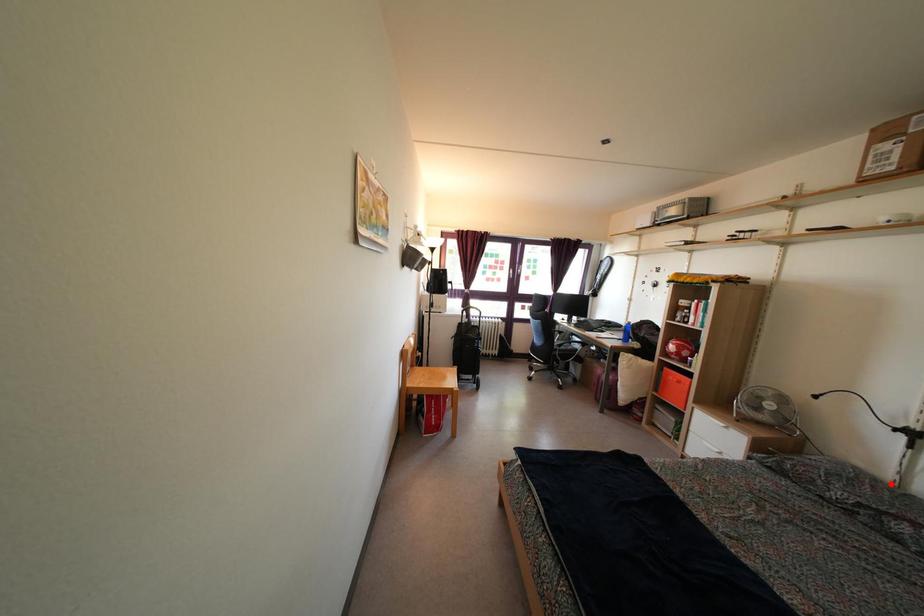
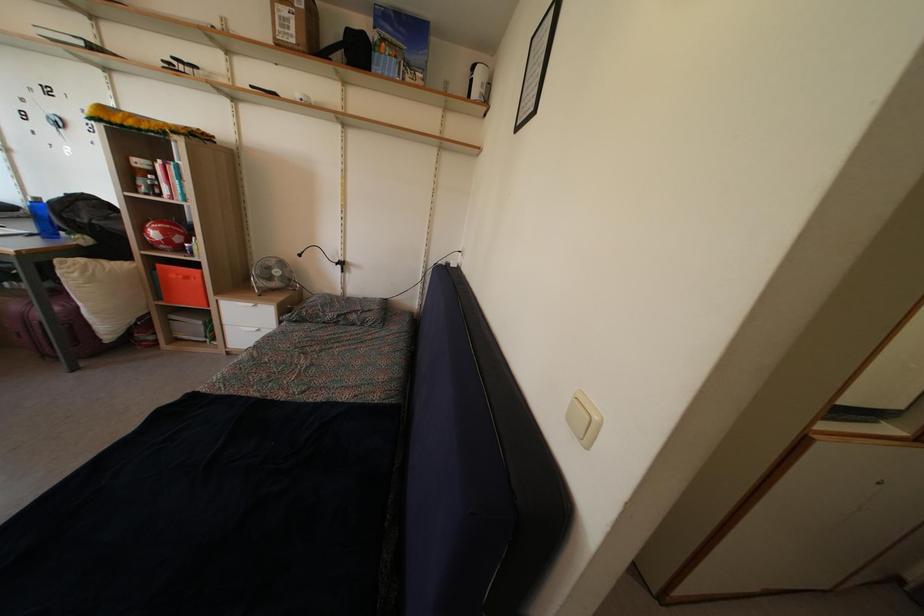
Question: I am providing you with two images of the same scene from different viewpoints. A red point is shown in image1. For the corresponding object point in image2, is it positioned nearer or farther from the camera?

Choices:
 (A) Nearer
 (B) Farther

Answer: (A)